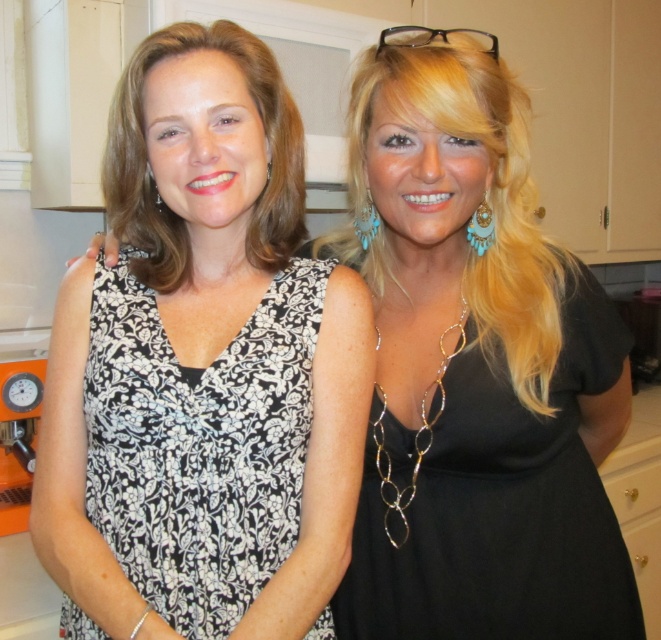
Is black matte dress at right wider than black floral fabric dress at center?

Yes, black matte dress at right is wider than black floral fabric dress at center.

Does black matte dress at right have a smaller size compared to black floral fabric dress at center?

No, black matte dress at right is not smaller than black floral fabric dress at center.

Describe the element at coordinates (502, 502) in the screenshot. I see `black matte dress at right` at that location.

In order to click on black matte dress at right in this screenshot , I will do `click(502, 502)`.